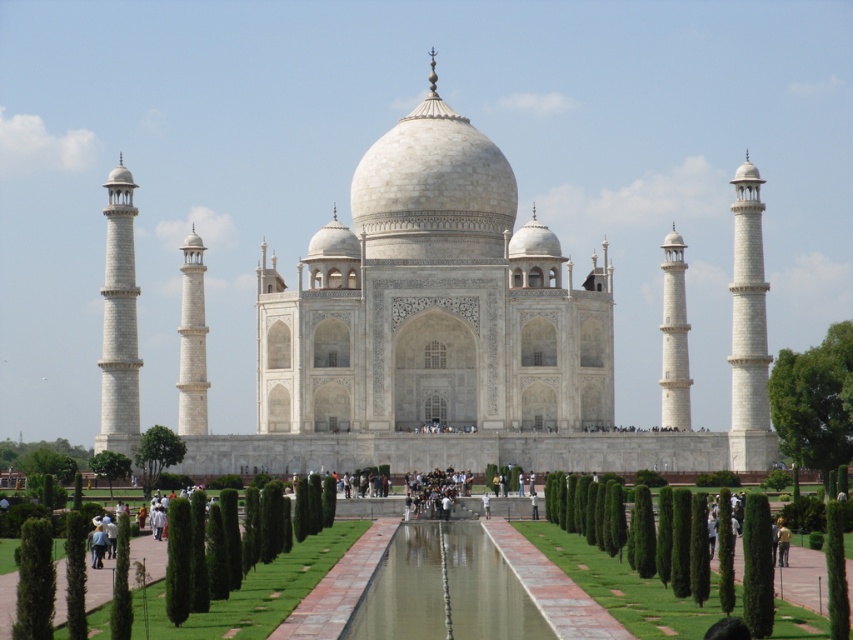
You are standing in front of the Taj Mahal and want to take a photo that includes both the green grass at center and the dark blue jeans at center. Which object should you position to the left side of your camera frame to ensure both are visible?

To include both the green grass at center and the dark blue jeans at center in your photo, position the dark blue jeans at center on the left side of the camera frame since the green grass at center is to the right of it.

You are a tourist visiting the Taj Mahal and want to take a photo that includes both the white marble taj mahal at center and the green grass at center. Which object will appear larger in your photo?

The white marble taj mahal at center will appear larger in the photo because it is taller than the green grass at center.